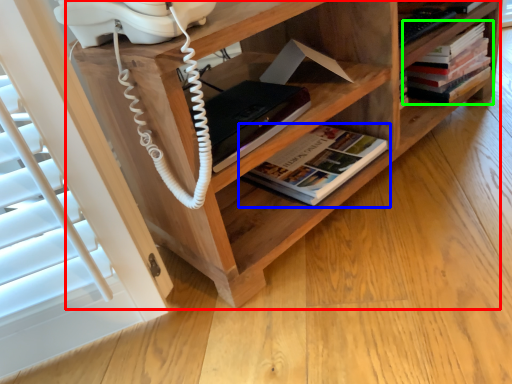
Question: Which object is the farthest from shelf (highlighted by a red box)? Choose among these: book (highlighted by a blue box) or book (highlighted by a green box).

Choices:
 (A) book
 (B) book

Answer: (B)